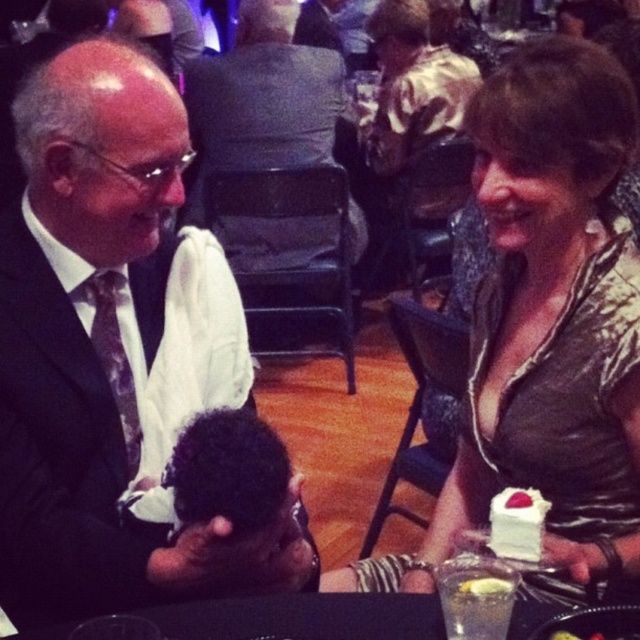
Question: Which point is farther to the camera?

Choices:
 (A) 499,550
 (B) 474,346
 (C) 310,74
 (D) 122,99

Answer: (C)

Question: Does shiny metallic dress at center have a smaller size compared to dark curly hair at center?

Choices:
 (A) yes
 (B) no

Answer: (B)

Question: Which point is closer to the camera?

Choices:
 (A) shiny metallic dress at center
 (B) dark curly hair at center
 (C) white cream cake at right

Answer: (C)

Question: Estimate the real-world distances between objects in this image. Which object is closer to the black plastic table at lower center?

Choices:
 (A) shiny metallic dress at center
 (B) white cream cake at right

Answer: (B)

Question: Does black plastic table at lower center have a greater width compared to white cream cake at right?

Choices:
 (A) yes
 (B) no

Answer: (A)

Question: Is black plastic table at lower center above white creamy cake at lower right?

Choices:
 (A) yes
 (B) no

Answer: (B)